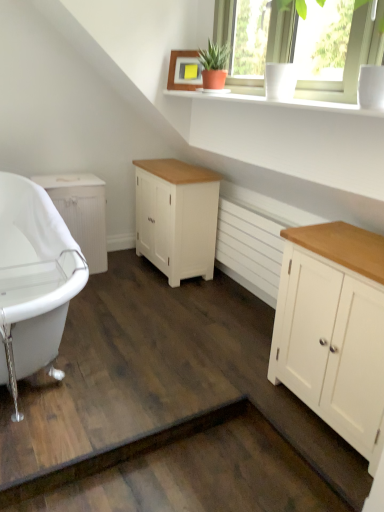
I want to click on blank area beneath wooden picture frame at upper center (from a real-world perspective), so click(x=190, y=99).